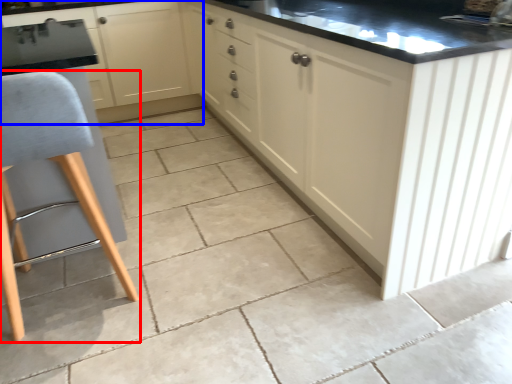
Question: Which point is further to the camera, furniture (highlighted by a red box) or cabinetry (highlighted by a blue box)?

Choices:
 (A) furniture
 (B) cabinetry

Answer: (B)